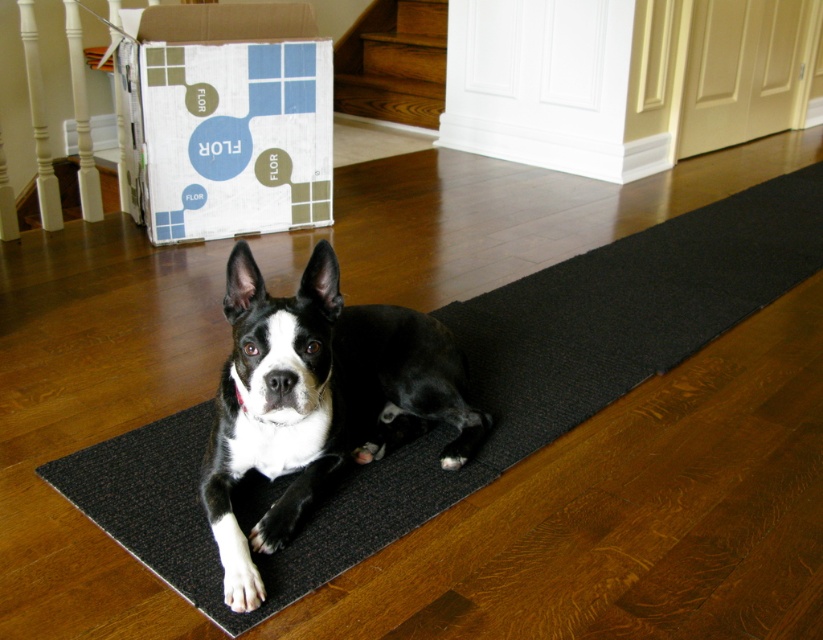
You are standing in the room and want to pick up two items located at point (361, 529) and point (308, 168). Which point is closer to you?

Point (361, 529) is closer to the camera than point (308, 168), so you should pick up the item at point (361, 529) first as it is closer to you.